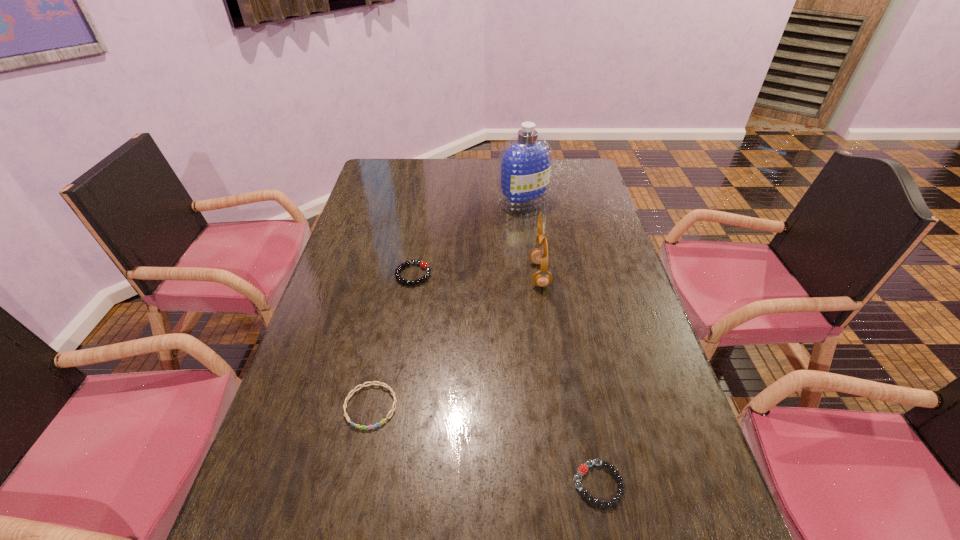
Locate an element on the screen. This screenshot has height=540, width=960. the third closest bracelet to the farthest object is located at coordinates (583, 468).

Identify which bracelet is the closest to the earphone. Please provide its 2D coordinates. Your answer should be formatted as a tuple, i.e. [(x, y)], where the tuple contains the x and y coordinates of a point satisfying the conditions above.

[(424, 265)]

Find the location of `vacant space that satisfies the following two spatial constraints: 1. on the front-facing side of the fourth shortest object; 2. on the surface of the second farthest bracelet showing star-shaped elements`. vacant space that satisfies the following two spatial constraints: 1. on the front-facing side of the fourth shortest object; 2. on the surface of the second farthest bracelet showing star-shaped elements is located at coordinates pos(560,406).

Where is `vacant space that satisfies the following two spatial constraints: 1. on the back side of the farthest object; 2. on the right side of the farthest bracelet`? vacant space that satisfies the following two spatial constraints: 1. on the back side of the farthest object; 2. on the right side of the farthest bracelet is located at coordinates (425, 202).

Identify the location of free location that satisfies the following two spatial constraints: 1. on the surface of the nearest object showing star-shaped elements; 2. on the left side of the second nearest bracelet. (354, 484).

Where is `vacant space that satisfies the following two spatial constraints: 1. on the front-facing side of the earphone; 2. on the surface of the fourth farthest object showing star-shaped elements`? vacant space that satisfies the following two spatial constraints: 1. on the front-facing side of the earphone; 2. on the surface of the fourth farthest object showing star-shaped elements is located at coordinates (560, 406).

Locate an element on the screen. free space that satisfies the following two spatial constraints: 1. on the front-facing side of the fourth shortest object; 2. on the back side of the rightmost bracelet is located at coordinates (571, 484).